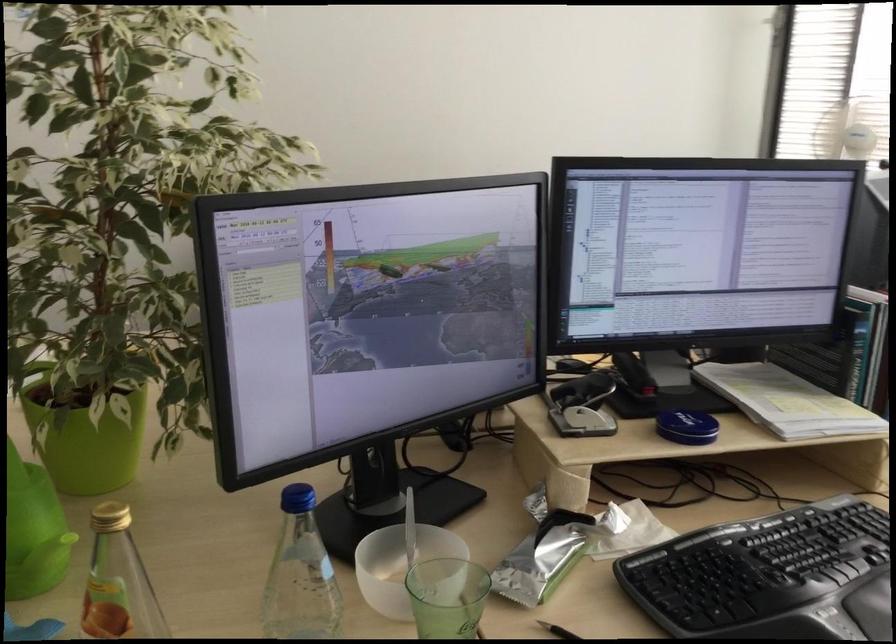
The width and height of the screenshot is (896, 644). What do you see at coordinates (297, 498) in the screenshot? I see `the blue tin lid` at bounding box center [297, 498].